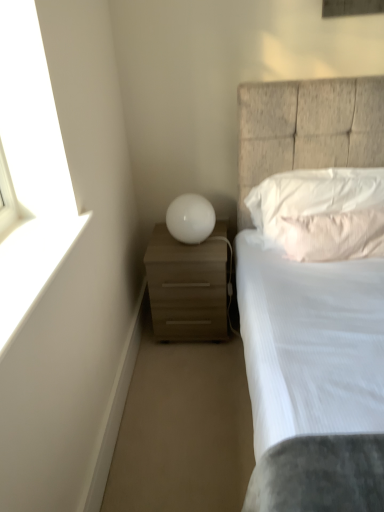
The image size is (384, 512). I want to click on vacant space in front of white glossy sphere at center, so click(189, 254).